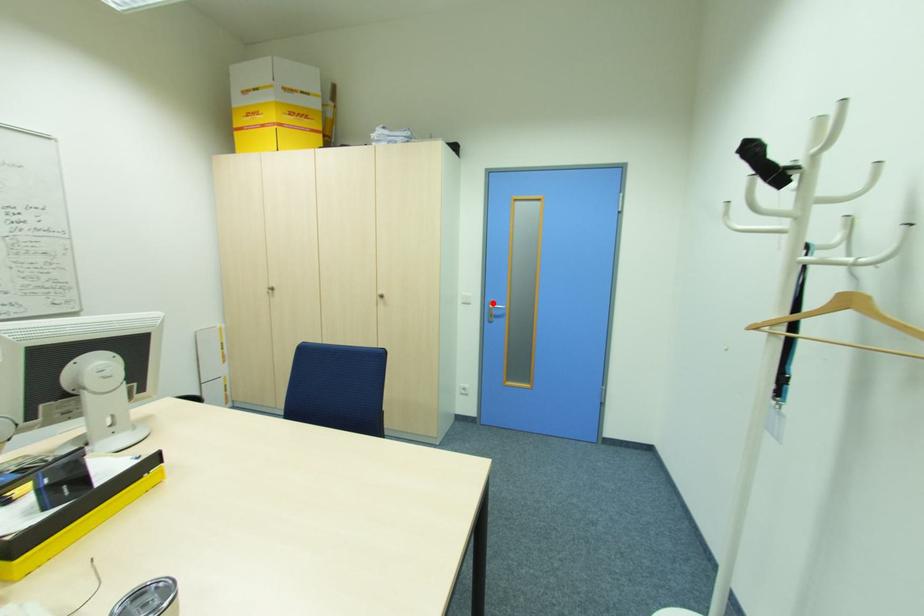
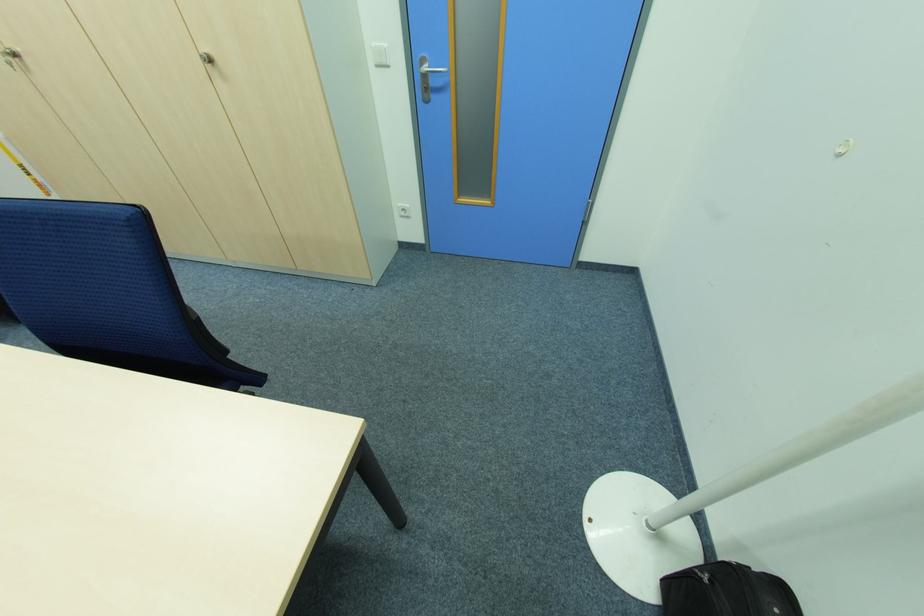
The point at the highlighted location is marked in the first image. Where is the corresponding point in the second image?

(424, 63)